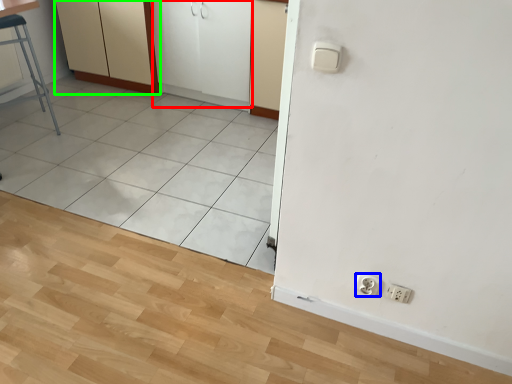
Question: Considering the real-world distances, which object is closest to screen door (highlighted by a red box)? socket (highlighted by a blue box) or dresser (highlighted by a green box).

Choices:
 (A) socket
 (B) dresser

Answer: (B)